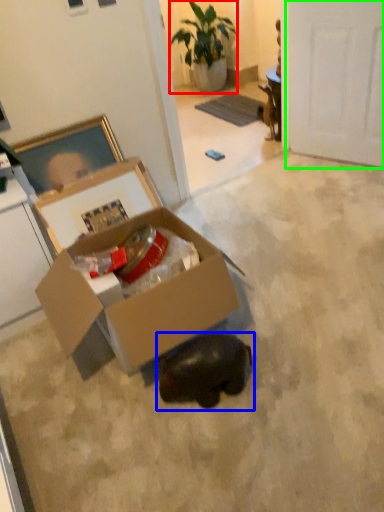
Question: Estimate the real-world distances between objects in this image. Which object is closer to houseplant (highlighted by a red box), animal (highlighted by a blue box) or door (highlighted by a green box)?

Choices:
 (A) animal
 (B) door

Answer: (B)